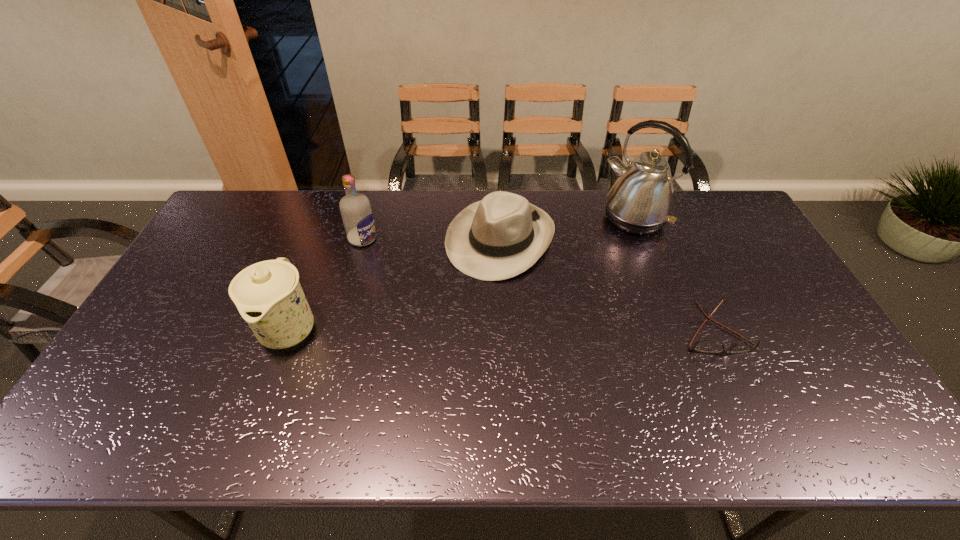
Identify the location of vacant space on the desktop that is between the chinaware and the shortest object and is positioned from the spout of the kettle. (522, 330).

Find the location of `free space on the desktop that is between the leftmost object and the spectacles and is positioned on the label of the vodka`. free space on the desktop that is between the leftmost object and the spectacles and is positioned on the label of the vodka is located at coordinates (514, 330).

At what (x,y) coordinates should I click in order to perform the action: click on vacant space on the desktop that is between the chinaware and the spectacles and is positioned on the front-facing side of the third object from left to right. Please return your answer as a coordinate pair (x, y). The width and height of the screenshot is (960, 540). Looking at the image, I should click on 441,329.